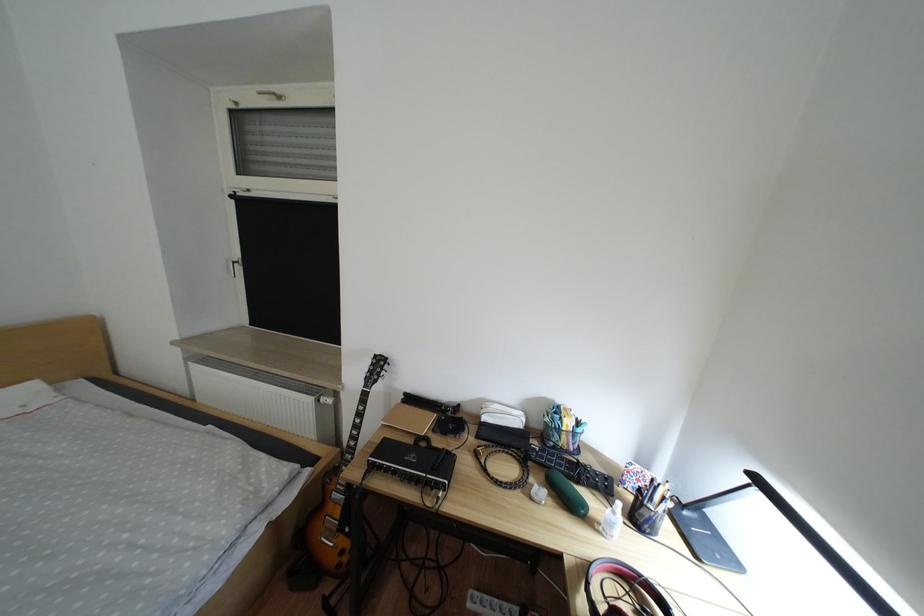
Image resolution: width=924 pixels, height=616 pixels. Identify the location of white bottle pump. (612, 521).